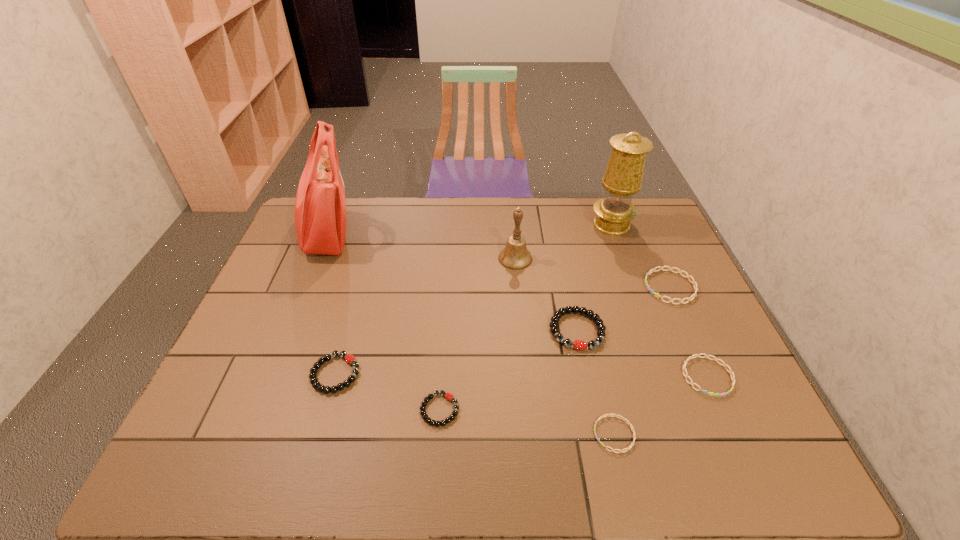
I want to click on free space at the near right corner of the desktop, so click(x=719, y=468).

Where is `free space between the handbag and the second farthest blue bracelet`? The image size is (960, 540). free space between the handbag and the second farthest blue bracelet is located at coordinates (517, 306).

Locate an element on the screen. Image resolution: width=960 pixels, height=540 pixels. free space between the oil lamp and the second black bracelet from left to right is located at coordinates (526, 317).

Find the location of `vacant region between the third tallest object and the red handbag`. vacant region between the third tallest object and the red handbag is located at coordinates (421, 246).

This screenshot has width=960, height=540. In order to click on vacant space in between the second nearest blue bracelet and the farthest blue bracelet in this screenshot , I will do (x=688, y=332).

Find the location of a particular element. free space that is in between the second smallest blue bracelet and the farthest black bracelet is located at coordinates (642, 353).

At what (x,y) coordinates should I click in order to perform the action: click on free space between the smallest black bracelet and the red handbag. Please return your answer as a coordinate pair (x, y). Image resolution: width=960 pixels, height=540 pixels. Looking at the image, I should click on (383, 322).

Locate an element on the screen. The height and width of the screenshot is (540, 960). vacant area that lies between the second nearest blue bracelet and the smallest blue bracelet is located at coordinates (660, 405).

Find the location of a particular element. Image resolution: width=960 pixels, height=540 pixels. empty location between the shortest object and the second black bracelet from right to left is located at coordinates (527, 422).

The height and width of the screenshot is (540, 960). Identify the location of vacant point located between the second smallest blue bracelet and the oil lamp. (660, 300).